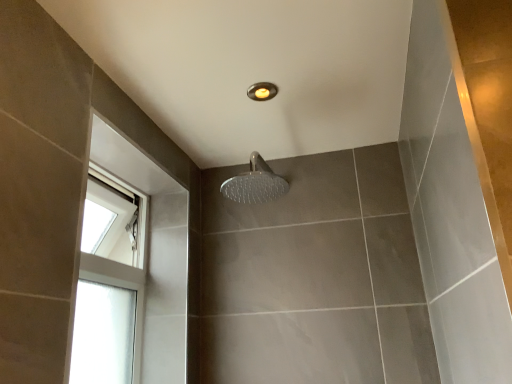
What do you see at coordinates (110, 283) in the screenshot? This screenshot has height=384, width=512. I see `clear glass window at left` at bounding box center [110, 283].

The width and height of the screenshot is (512, 384). I want to click on clear glass window at left, so click(x=110, y=283).

What is the approximate width of clear glass window at left?

clear glass window at left is 5.35 inches wide.

Image resolution: width=512 pixels, height=384 pixels. I want to click on clear glass window at left, so click(x=110, y=283).